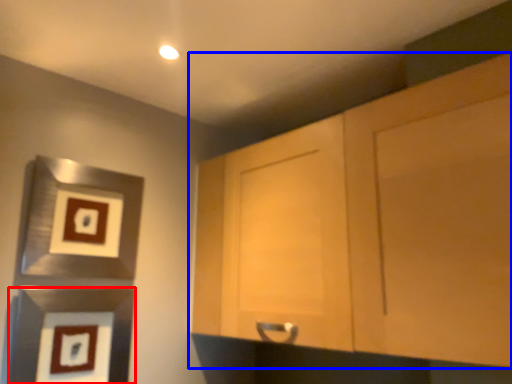
Question: Among these objects, which one is farthest to the camera, picture frame (highlighted by a red box) or cabinetry (highlighted by a blue box)?

Choices:
 (A) picture frame
 (B) cabinetry

Answer: (A)